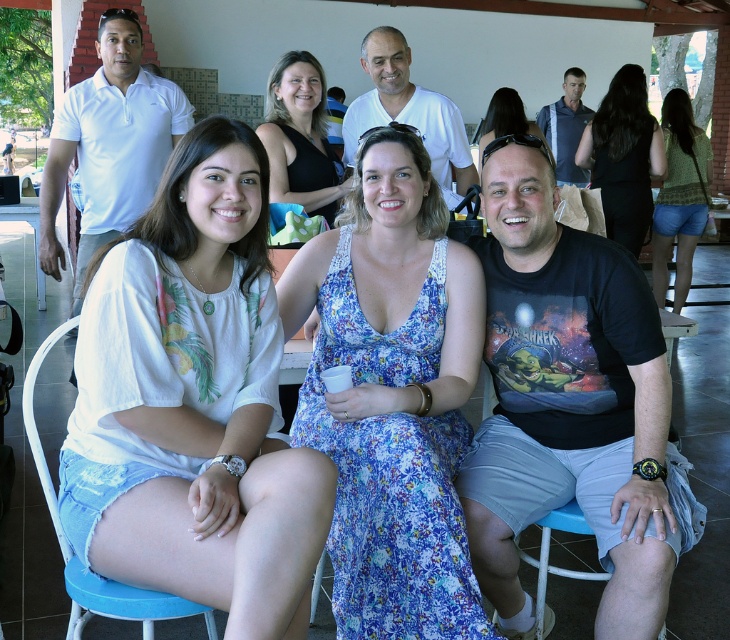
Question: Is black matte dress at upper center positioned in front of green textured blouse at right?

Choices:
 (A) yes
 (B) no

Answer: (A)

Question: Which point is closer to the camera?

Choices:
 (A) blue plastic chair at lower left
 (B) black matte dress at upper center

Answer: (A)

Question: Is white cotton shirt at center thinner than matte black sunglasses at upper center?

Choices:
 (A) yes
 (B) no

Answer: (B)

Question: Can you confirm if white cotton shirt at center is positioned above black matte dress at upper center?

Choices:
 (A) no
 (B) yes

Answer: (A)

Question: Which object appears farthest from the camera in this image?

Choices:
 (A) black matte dress at upper center
 (B) matte black sunglasses at upper center

Answer: (B)

Question: Which is nearer to the floral fabric dress at center?

Choices:
 (A) white cotton shirt at center
 (B) black matte dress at upper center

Answer: (A)